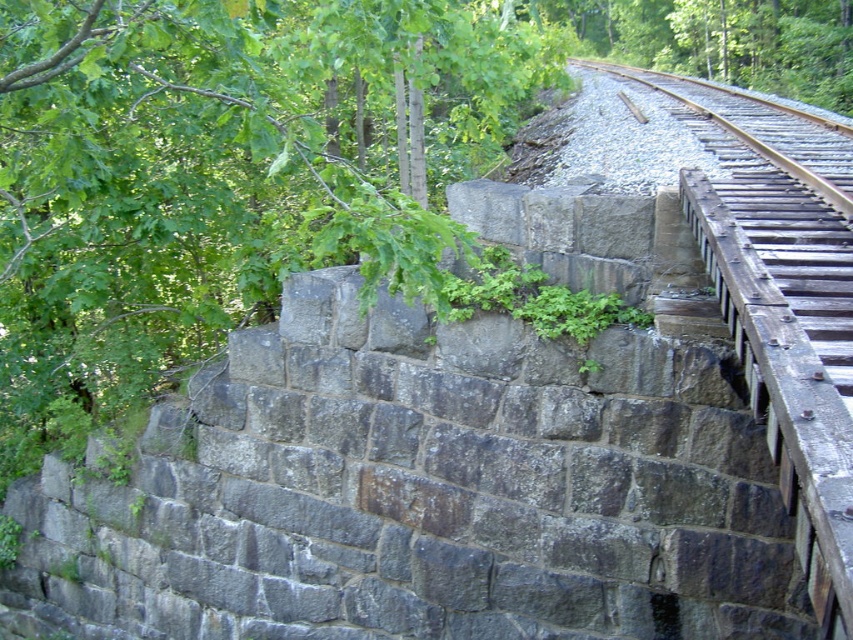
Is green leafy tree at upper left to the right of smooth brown wood at upper right from the viewer's perspective?

No, green leafy tree at upper left is not to the right of smooth brown wood at upper right.

Is point (445, 19) closer to camera compared to point (741, 138)?

Yes, it is in front of point (741, 138).

At what (x,y) coordinates should I click in order to perform the action: click on green leafy tree at upper left. Please return your answer as a coordinate pair (x, y). The height and width of the screenshot is (640, 853). Looking at the image, I should click on click(218, 177).